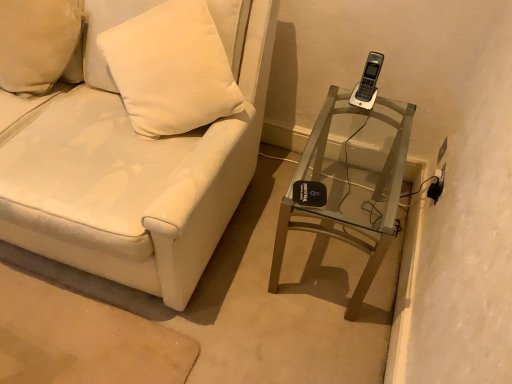
Where is `white leather couch at center`? Image resolution: width=512 pixels, height=384 pixels. white leather couch at center is located at coordinates (133, 166).

The width and height of the screenshot is (512, 384). Describe the element at coordinates (39, 44) in the screenshot. I see `white matte pillow at upper left` at that location.

The height and width of the screenshot is (384, 512). I want to click on clear glass table at right, so click(351, 183).

Identify the location of white leather couch at center. This screenshot has width=512, height=384. (133, 166).

Find the location of a particular element. furniture on the right side of white matte pillow at upper left is located at coordinates (133, 166).

Is white leather couch at center facing away from white matte pillow at upper left?

That's right, white leather couch at center is facing away from white matte pillow at upper left.

Is white leather couch at center completely or partially outside of white matte pillow at upper left?

Yes, white leather couch at center is outside of white matte pillow at upper left.

Which of these two, white leather couch at center or white matte pillow at upper left, is thinner?

white matte pillow at upper left is thinner.

Does point (360, 277) come closer to viewer compared to point (18, 207)?

No, (360, 277) is further to viewer.

Considering the relative positions of clear glass table at right and white leather couch at center in the image provided, is clear glass table at right to the right of white leather couch at center from the viewer's perspective?

Correct, you'll find clear glass table at right to the right of white leather couch at center.

Considering the sizes of objects clear glass table at right and white leather couch at center in the image provided, who is taller, clear glass table at right or white leather couch at center?

white leather couch at center.

From a real-world perspective, is clear glass table at right located beneath white leather couch at center?

Yes, from a real-world perspective, clear glass table at right is under white leather couch at center.

Looking at the image, does clear glass table at right seem bigger or smaller compared to white matte pillow at upper left?

clear glass table at right is bigger than white matte pillow at upper left.

Who is taller, clear glass table at right or white matte pillow at upper left?

clear glass table at right is taller.

Is clear glass table at right with white matte pillow at upper left?

clear glass table at right and white matte pillow at upper left are clearly separated.

Is white matte pillow at upper left far away from clear glass table at right?

Yes, white matte pillow at upper left is far from clear glass table at right.

Is point (34, 95) behind point (387, 185)?

Yes.

Is clear glass table at right at the back of white matte pillow at upper left?

No, white matte pillow at upper left's orientation is not away from clear glass table at right.

Between point (215, 224) and point (397, 196), which one is positioned behind?

The point (215, 224) is more distant.

What's the angular difference between white leather couch at center and clear glass table at right's facing directions?

1.35 degrees separate the facing orientations of white leather couch at center and clear glass table at right.

Is white leather couch at center far from clear glass table at right?

No, white leather couch at center is not far away from clear glass table at right.

From a real-world perspective, between white leather couch at center and clear glass table at right, who is vertically lower?

clear glass table at right, from a real-world perspective.

From a real-world perspective, is white matte pillow at upper left physically located above or below white leather couch at center?

In terms of real-world spatial position, white matte pillow at upper left is above white leather couch at center.

Can you tell me how much white matte pillow at upper left and white leather couch at center differ in facing direction?

The angular difference between white matte pillow at upper left and white leather couch at center is 2.05 degrees.

Between white matte pillow at upper left and white leather couch at center, which one has larger width?

white leather couch at center is wider.

Is point (14, 55) farther from camera compared to point (166, 167)?

Yes, point (14, 55) is farther from viewer.

Locate an element on the screen. This screenshot has height=384, width=512. pillow on the left of the white leather couch at center is located at coordinates (39, 44).

Locate an element on the screen. furniture above the clear glass table at right (from the image's perspective) is located at coordinates (133, 166).

Looking at the image, which one is located further to clear glass table at right, white leather couch at center or white matte pillow at upper left?

Among the two, white matte pillow at upper left is located further to clear glass table at right.

From the image, which object appears to be farther from white matte pillow at upper left, clear glass table at right or white leather couch at center?

Among the two, clear glass table at right is located further to white matte pillow at upper left.

From the image, which object appears to be nearer to white matte pillow at upper left, white leather couch at center or clear glass table at right?

Based on the image, white leather couch at center appears to be nearer to white matte pillow at upper left.

When comparing their distances from clear glass table at right, does white matte pillow at upper left or white leather couch at center seem further?

white matte pillow at upper left.

Looking at the image, which one is located closer to white leather couch at center, white matte pillow at upper left or clear glass table at right?

The object closer to white leather couch at center is white matte pillow at upper left.

Considering their positions, is clear glass table at right positioned closer to white leather couch at center than white matte pillow at upper left?

The object closer to white leather couch at center is white matte pillow at upper left.

Where is `furniture between white matte pillow at upper left and clear glass table at right`? furniture between white matte pillow at upper left and clear glass table at right is located at coordinates (133, 166).